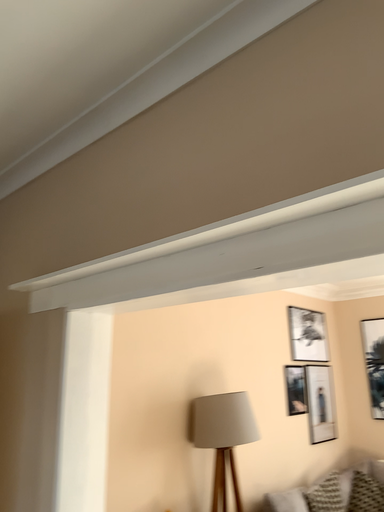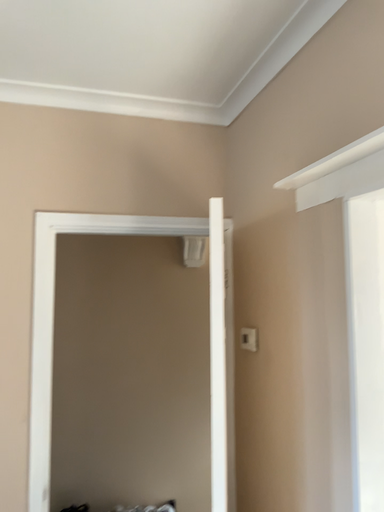
Question: Which way did the camera rotate in the video?

Choices:
 (A) rotated upward
 (B) rotated downward

Answer: (B)